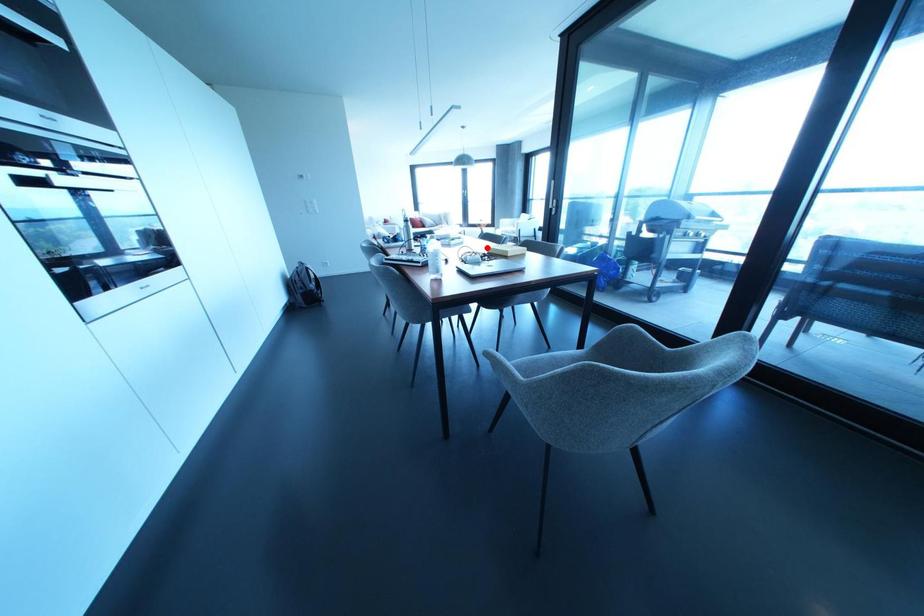
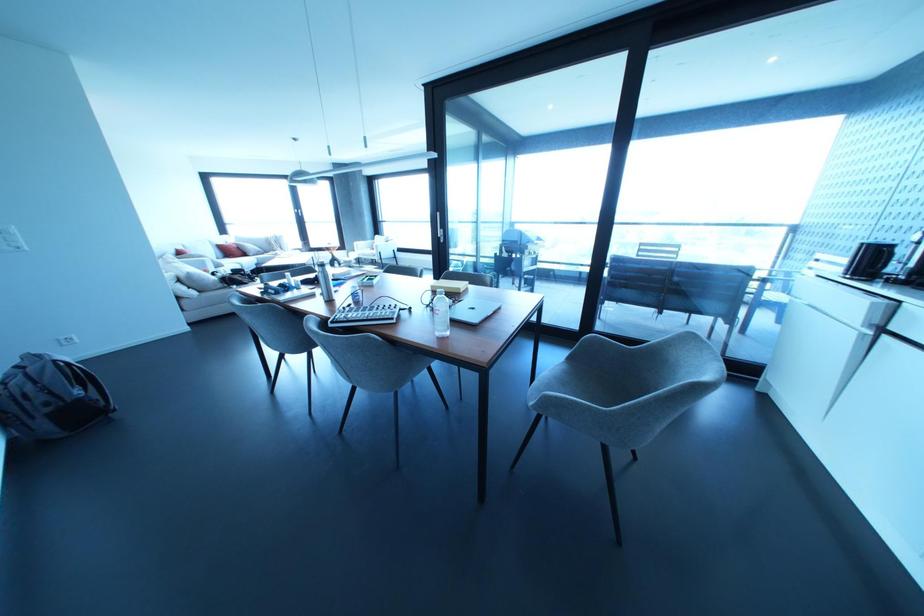
Question: I am providing you with two images of the same scene from different viewpoints. A red point is shown in image1. For the corresponding object point in image2, is it positioned nearer or farther from the camera?

Choices:
 (A) Nearer
 (B) Farther

Answer: (B)